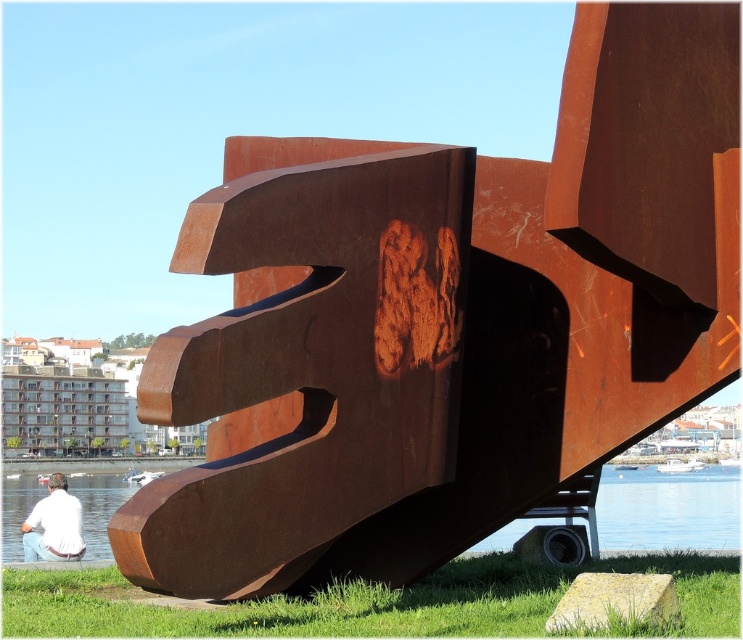
Question: Which of the following is the farthest from the observer?

Choices:
 (A) green grass at lower center
 (B) clear blue water at lower center
 (C) white shirt at lower left

Answer: (C)

Question: Can you confirm if clear blue water at lower center is positioned below white shirt at lower left?

Choices:
 (A) yes
 (B) no

Answer: (B)

Question: Which object appears closest to the camera in this image?

Choices:
 (A) green grass at lower center
 (B) clear blue water at lower center
 (C) white shirt at lower left

Answer: (A)

Question: Is green grass at lower center smaller than clear blue water at lower center?

Choices:
 (A) no
 (B) yes

Answer: (B)

Question: Which is nearer to the green grass at lower center?

Choices:
 (A) white shirt at lower left
 (B) clear blue water at lower center

Answer: (A)

Question: Can you confirm if green grass at lower center is positioned above clear blue water at lower center?

Choices:
 (A) no
 (B) yes

Answer: (B)